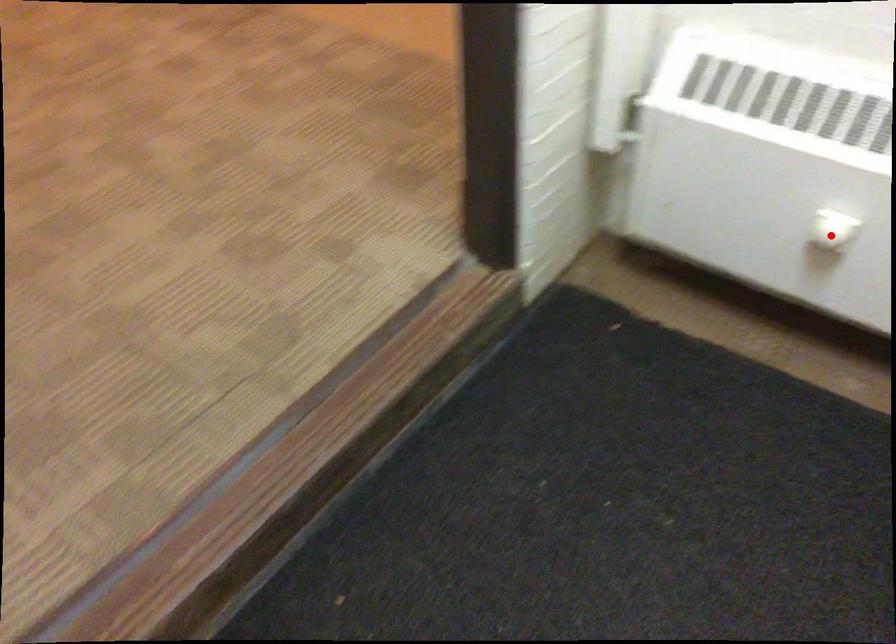
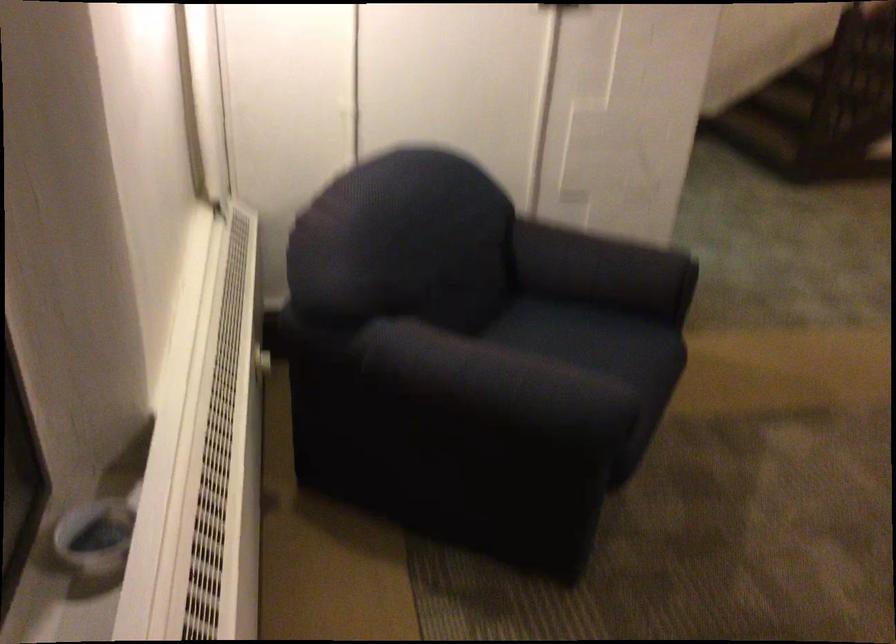
Question: I am providing you with two images of the same scene from different viewpoints. A red point is marked on the first image. Can you still see the location of the red point in image 2?

Choices:
 (A) Yes
 (B) No

Answer: (B)